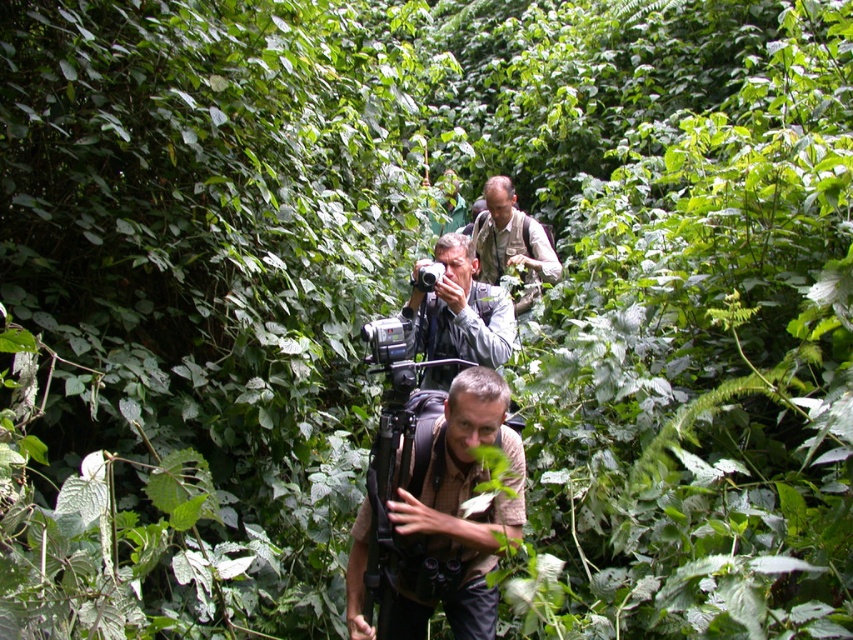
Can you confirm if brown fabric backpack at center is smaller than khaki fabric shirt at center?

Indeed, brown fabric backpack at center has a smaller size compared to khaki fabric shirt at center.

Does brown fabric backpack at center have a lesser height compared to khaki fabric shirt at center?

Correct, brown fabric backpack at center is not as tall as khaki fabric shirt at center.

You are a GUI agent. You are given a task and a screenshot of the screen. Output one action in this format:
    pyautogui.click(x=<x>, y=<y>)
    Task: Click on the brown fabric backpack at center
    The width and height of the screenshot is (853, 640).
    Given the screenshot: What is the action you would take?
    pyautogui.click(x=454, y=513)

Can you confirm if brown fabric backpack at center is positioned to the left of matte gray camera at center?

Incorrect, brown fabric backpack at center is not on the left side of matte gray camera at center.

Who is positioned more to the right, brown fabric backpack at center or matte gray camera at center?

From the viewer's perspective, brown fabric backpack at center appears more on the right side.

The height and width of the screenshot is (640, 853). I want to click on brown fabric backpack at center, so click(x=454, y=513).

Which of these two, matte gray camera at center or khaki fabric shirt at center, stands taller?

Standing taller between the two is khaki fabric shirt at center.

Which is more to the right, matte gray camera at center or khaki fabric shirt at center?

khaki fabric shirt at center is more to the right.

Describe the element at coordinates (460, 310) in the screenshot. I see `matte gray camera at center` at that location.

At what (x,y) coordinates should I click in order to perform the action: click on matte gray camera at center. Please return your answer as a coordinate pair (x, y). This screenshot has height=640, width=853. Looking at the image, I should click on (460, 310).